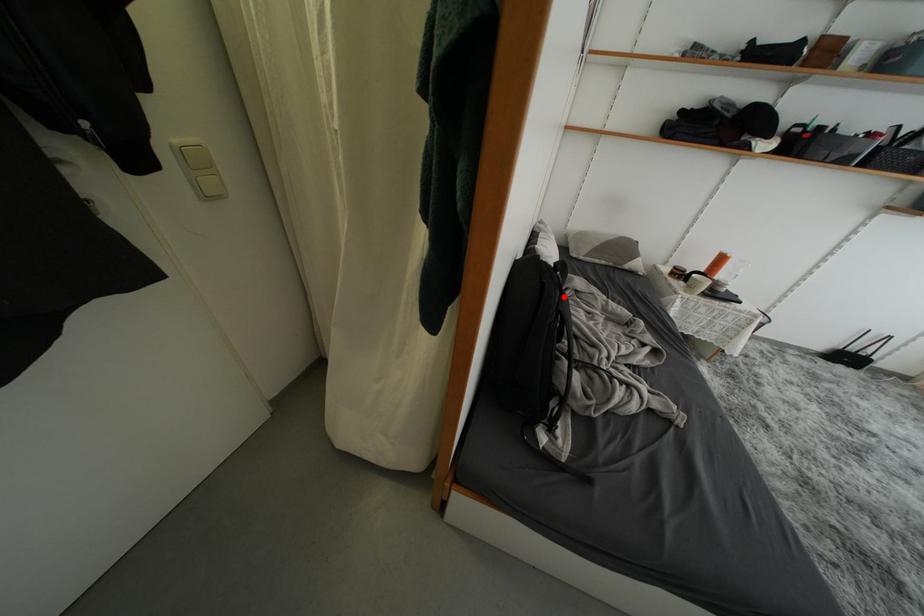
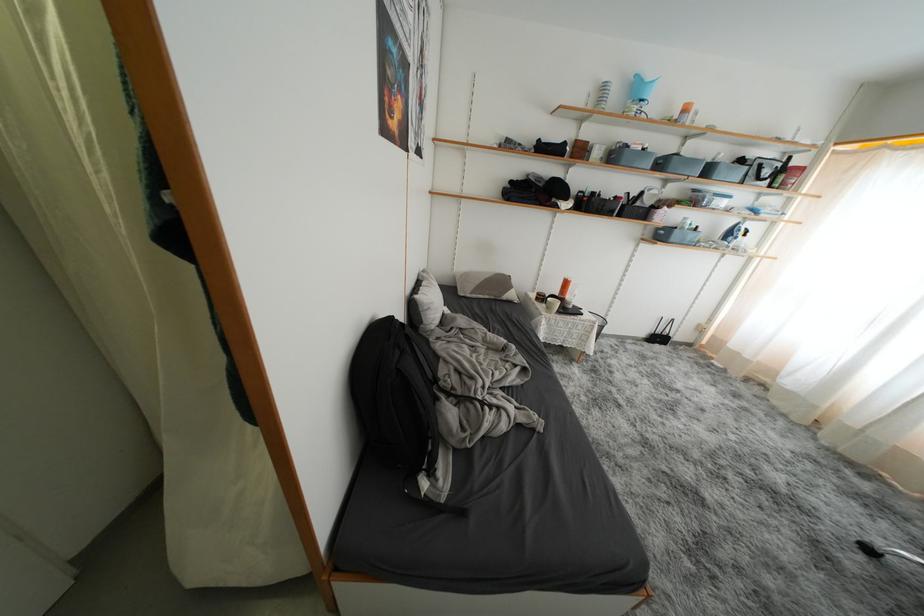
Where in the second image is the point corresponding to the highlighted location from the first image?

(404, 357)